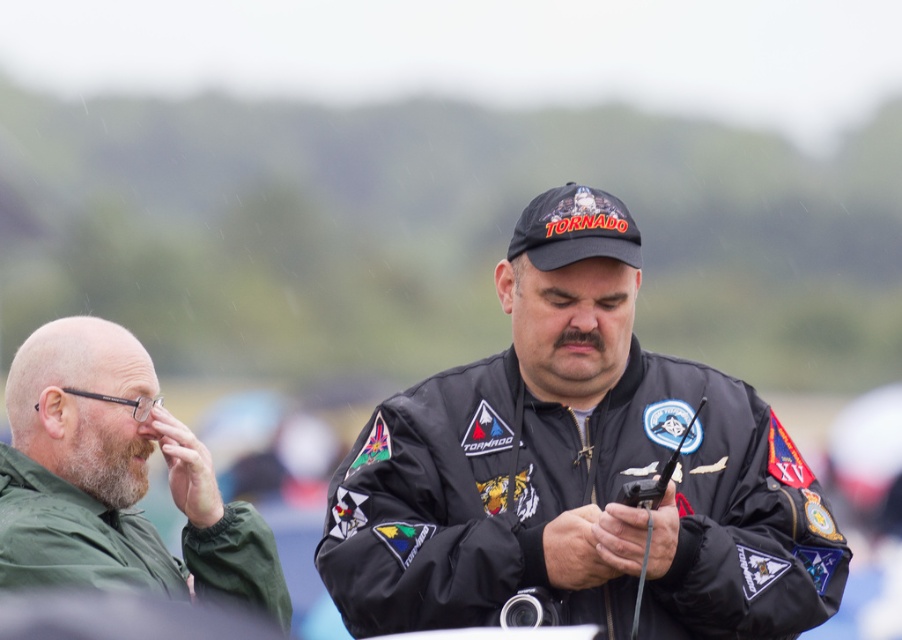
Question: Is black matte jacket at center above green matte jacket at left?

Choices:
 (A) yes
 (B) no

Answer: (A)

Question: In this image, where is black matte jacket at center located relative to green matte jacket at left?

Choices:
 (A) left
 (B) right

Answer: (B)

Question: Which point is closer to the camera?

Choices:
 (A) black matte jacket at center
 (B) green matte jacket at left

Answer: (B)

Question: Which point is farther to the camera?

Choices:
 (A) (63, 320)
 (B) (634, 365)

Answer: (A)

Question: Among these points, which one is nearest to the camera?

Choices:
 (A) (134, 522)
 (B) (810, 616)

Answer: (B)

Question: Can you confirm if black matte jacket at center is positioned above green matte jacket at left?

Choices:
 (A) no
 (B) yes

Answer: (B)